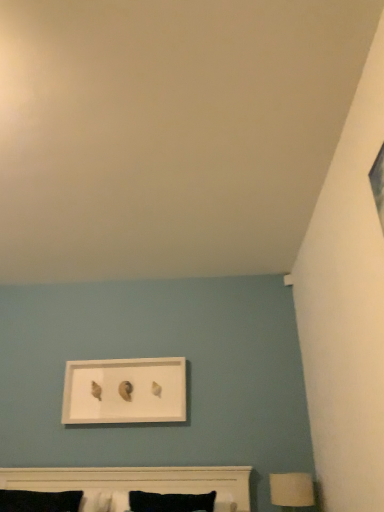
Question: From a real-world perspective, is white matte table lamp at lower right positioned under white matte bed at lower center based on gravity?

Choices:
 (A) no
 (B) yes

Answer: (B)

Question: Is white matte table lamp at lower right behind white matte bed at lower center?

Choices:
 (A) yes
 (B) no

Answer: (A)

Question: Could you tell me if white matte table lamp at lower right is facing white matte bed at lower center?

Choices:
 (A) yes
 (B) no

Answer: (B)

Question: Can you confirm if white matte table lamp at lower right is shorter than white matte bed at lower center?

Choices:
 (A) no
 (B) yes

Answer: (B)

Question: From a real-world perspective, is white matte table lamp at lower right physically above white matte bed at lower center?

Choices:
 (A) yes
 (B) no

Answer: (B)

Question: Is white matte bed at lower center to the left or to the right of white matte picture frame at upper center in the image?

Choices:
 (A) left
 (B) right

Answer: (B)

Question: Relative to white matte picture frame at upper center, is white matte bed at lower center in front or behind?

Choices:
 (A) front
 (B) behind

Answer: (A)

Question: Is white matte bed at lower center bigger or smaller than white matte picture frame at upper center?

Choices:
 (A) big
 (B) small

Answer: (A)

Question: From the image's perspective, is white matte bed at lower center above or below white matte picture frame at upper center?

Choices:
 (A) below
 (B) above

Answer: (A)

Question: From the image's perspective, relative to white matte picture frame at upper center, is white matte table lamp at lower right above or below?

Choices:
 (A) below
 (B) above

Answer: (A)

Question: Relative to white matte picture frame at upper center, is white matte table lamp at lower right in front or behind?

Choices:
 (A) behind
 (B) front

Answer: (B)

Question: Is white matte table lamp at lower right wider or thinner than white matte picture frame at upper center?

Choices:
 (A) thin
 (B) wide

Answer: (B)

Question: Is white matte table lamp at lower right situated inside white matte picture frame at upper center or outside?

Choices:
 (A) outside
 (B) inside

Answer: (A)

Question: From the image's perspective, is white matte table lamp at lower right positioned above or below white matte bed at lower center?

Choices:
 (A) below
 (B) above

Answer: (A)

Question: From a real-world perspective, is white matte table lamp at lower right positioned above or below white matte bed at lower center?

Choices:
 (A) above
 (B) below

Answer: (B)